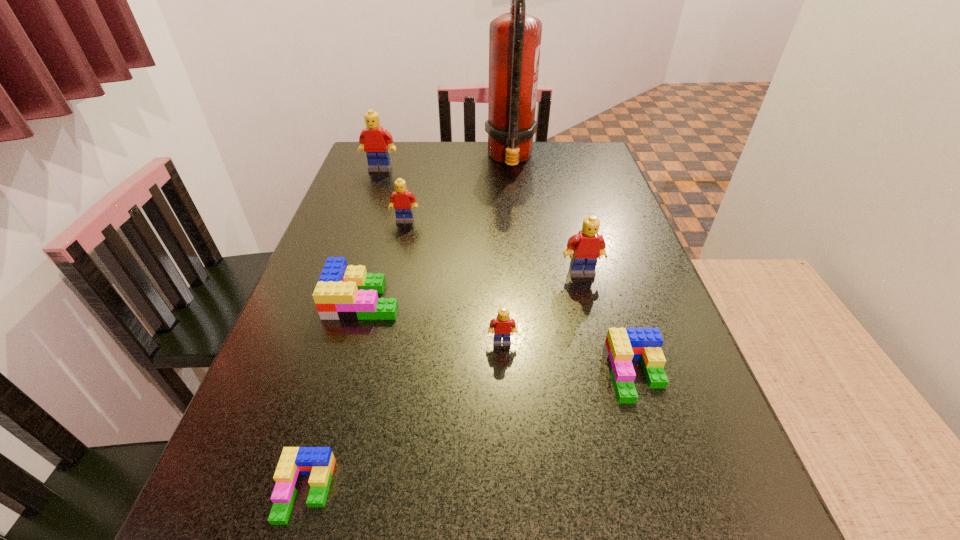
The width and height of the screenshot is (960, 540). Find the location of `vacant region between the red fire extinguisher and the second smallest yellow Lego`. vacant region between the red fire extinguisher and the second smallest yellow Lego is located at coordinates (458, 190).

Find the location of a particular element. This screenshot has width=960, height=540. vacant space in between the shortest object and the sixth tallest object is located at coordinates click(334, 395).

Find the location of `free spot between the fifth Lego from left to right and the fourth farthest object`. free spot between the fifth Lego from left to right and the fourth farthest object is located at coordinates (541, 307).

Locate which object is the fifth closest to the sixth nearest Lego. Please provide its 2D coordinates. Your answer should be formatted as a tuple, i.e. [(x, y)], where the tuple contains the x and y coordinates of a point satisfying the conditions above.

[(503, 326)]

Locate an element on the screen. Image resolution: width=960 pixels, height=540 pixels. the third closest object to the nearest green Lego is located at coordinates (622, 345).

You are a GUI agent. You are given a task and a screenshot of the screen. Output one action in this format:
    pyautogui.click(x=<x>, y=<y>)
    Task: Click on the Lego that is the fifth nearest to the fifth tallest object
    Image resolution: width=960 pixels, height=540 pixels.
    Given the screenshot: What is the action you would take?
    pyautogui.click(x=403, y=201)

Identify which Lego is the second nearest to the third tallest Lego. Please provide its 2D coordinates. Your answer should be formatted as a tuple, i.e. [(x, y)], where the tuple contains the x and y coordinates of a point satisfying the conditions above.

[(374, 140)]

Identify the location of the fourth closest yellow Lego relative to the second nearest green Lego. Image resolution: width=960 pixels, height=540 pixels. (374, 140).

Find the location of a particular element. This screenshot has width=960, height=540. yellow Lego that stands as the second closest to the tallest object is located at coordinates (403, 201).

Select which green Lego appears as the closest to the second smallest yellow Lego. Please provide its 2D coordinates. Your answer should be formatted as a tuple, i.e. [(x, y)], where the tuple contains the x and y coordinates of a point satisfying the conditions above.

[(343, 292)]